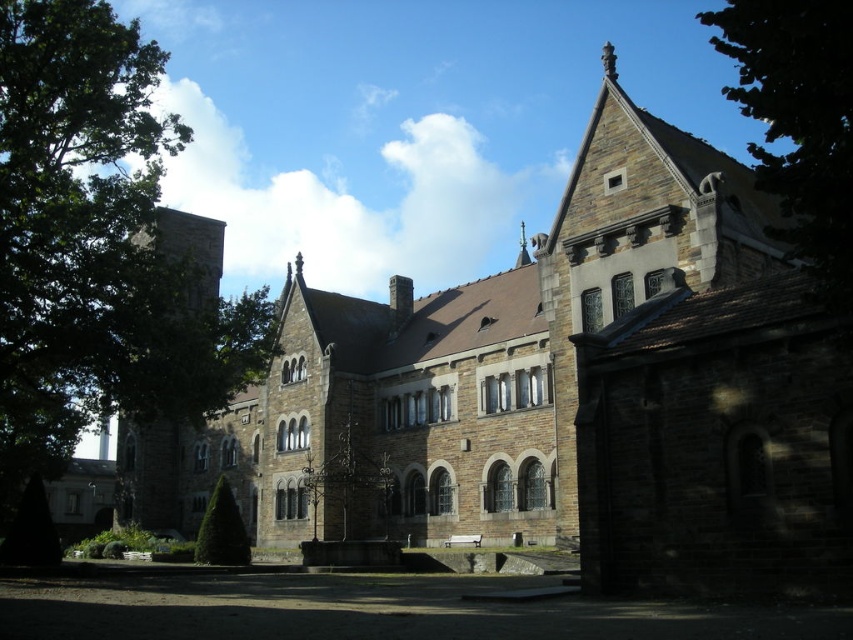
You are a visitor standing at the entrance of the brown stone church at center and want to take a photo of the green leafy tree at center. Can you see the tree clearly without any obstruction?

The brown stone church at center is in front of the green leafy tree at center, so the church will block the view of the tree. You cannot see the tree clearly without moving to a different position.

In the scene shown: You are planning to take a photo of the brown stone church at center and the green leafy tree at center from a position where both are visible. Based on their sizes, which object should you focus on first to ensure both fit in the frame?

The brown stone church at center might be wider than the green leafy tree at center, so you should focus on ensuring the brown stone church at center fits first to accommodate its width.